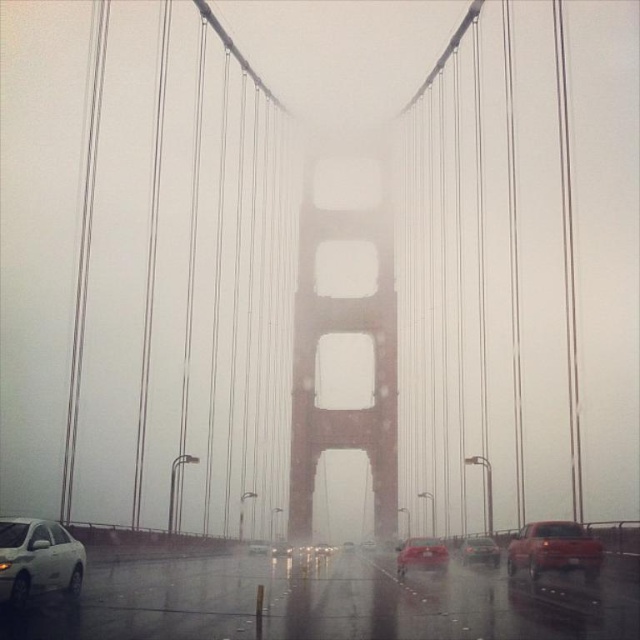
Is white glossy sedan at lower left positioned behind metallic silver car at center?

No.

Can you confirm if white glossy sedan at lower left is positioned to the left of metallic silver car at center?

Yes, white glossy sedan at lower left is to the left of metallic silver car at center.

Locate an element on the screen. The width and height of the screenshot is (640, 640). white glossy sedan at lower left is located at coordinates (36, 560).

Does brick textured tower at center have a greater width compared to shiny red sedan at center?

Indeed, brick textured tower at center has a greater width compared to shiny red sedan at center.

Between point (378, 426) and point (445, 564), which one is positioned behind?

The point (378, 426) is behind.

The width and height of the screenshot is (640, 640). What are the coordinates of `brick textured tower at center` in the screenshot? It's located at (346, 321).

Between brick textured tower at center and metallic silver car at center, which one has more height?

Standing taller between the two is brick textured tower at center.

How distant is brick textured tower at center from metallic silver car at center?

The distance of brick textured tower at center from metallic silver car at center is 72.02 meters.

Who is more forward, (314, 176) or (280, 556)?

Point (280, 556)

You are a GUI agent. You are given a task and a screenshot of the screen. Output one action in this format:
    pyautogui.click(x=<x>, y=<y>)
    Task: Click on the brick textured tower at center
    
    Given the screenshot: What is the action you would take?
    pyautogui.click(x=346, y=321)